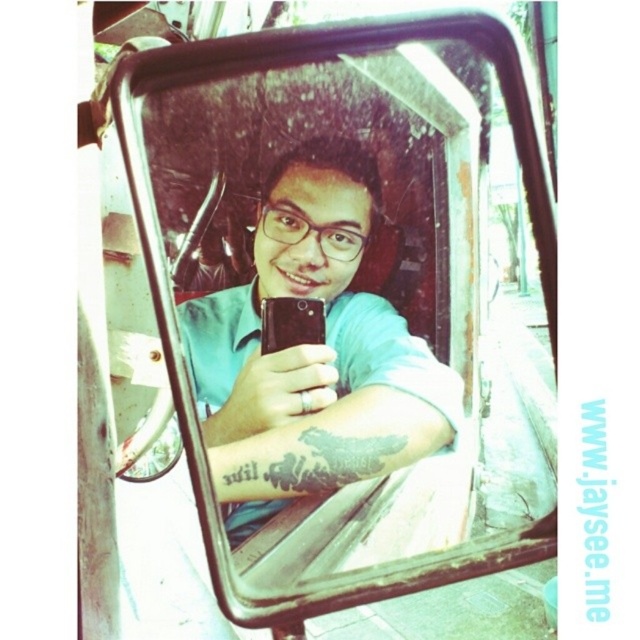
Between point (280, 460) and point (228, 540), which one is positioned behind?

The point (228, 540) is behind.

From the picture: Is clear glass mirror at center closer to camera compared to matte black phone at center?

Yes, it is.

The height and width of the screenshot is (640, 640). What do you see at coordinates (326, 321) in the screenshot? I see `clear glass mirror at center` at bounding box center [326, 321].

Where is `clear glass mirror at center`? clear glass mirror at center is located at coordinates (326, 321).